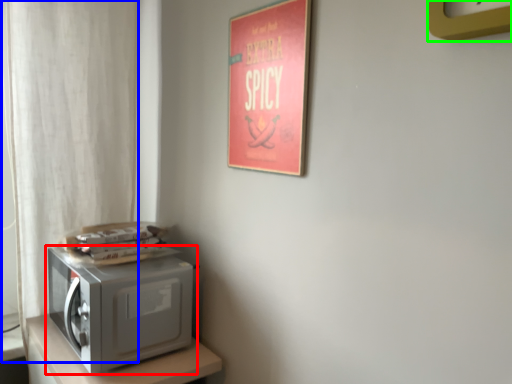
Question: Based on their relative distances, which object is nearer to home appliance (highlighted by a red box)? Choose from curtain (highlighted by a blue box) and clock (highlighted by a green box).

Choices:
 (A) curtain
 (B) clock

Answer: (A)